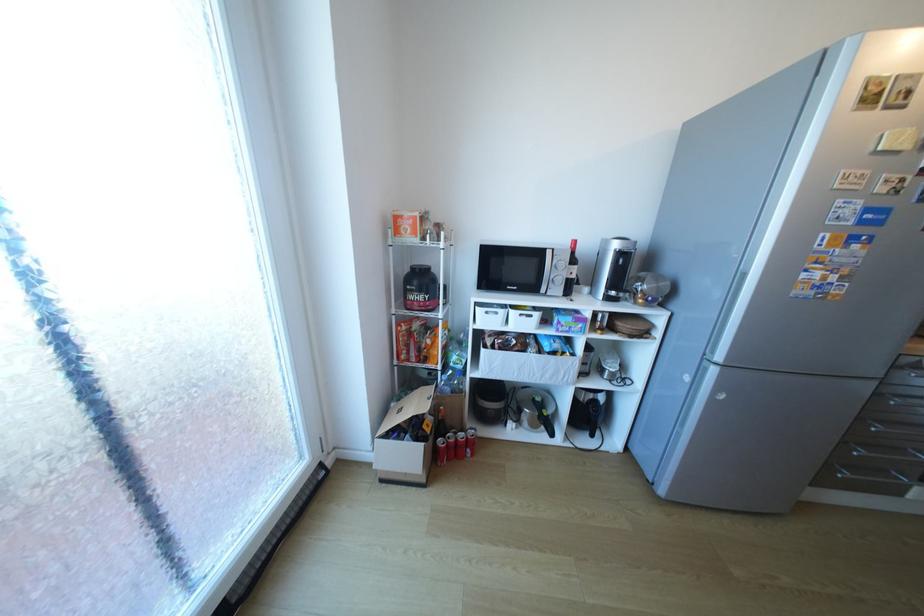
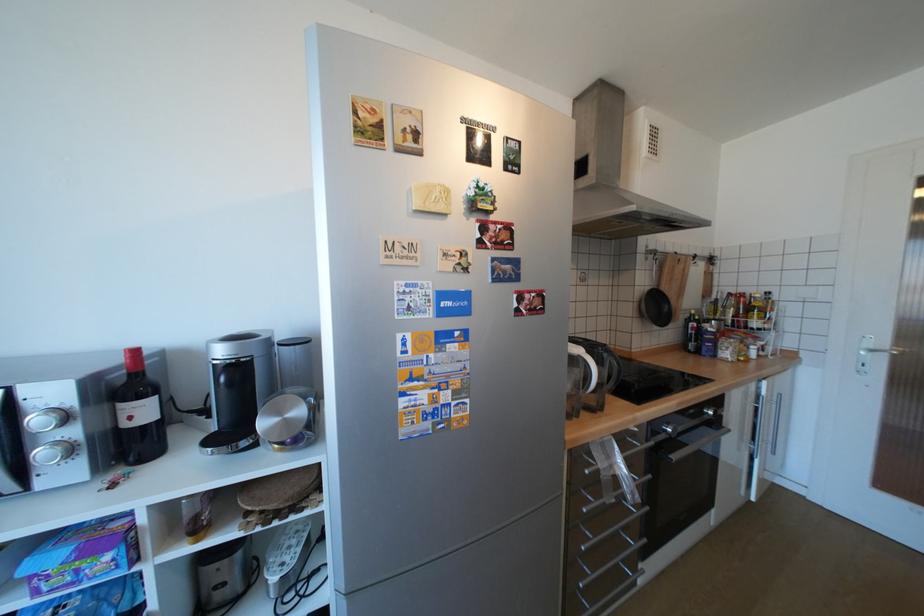
Locate, in the second image, the point that corresponds to [650,301] in the first image.

(286, 446)